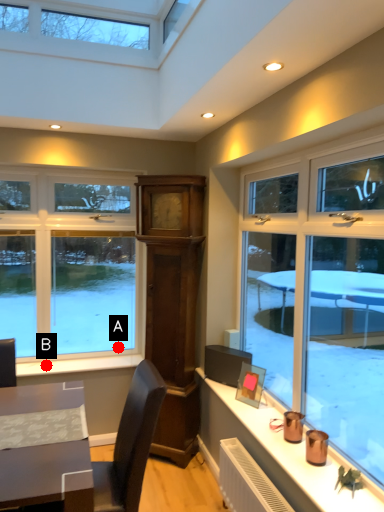
Question: Two points are circled on the image, labeled by A and B beside each circle. Which point is closer to the camera?

Choices:
 (A) A is closer
 (B) B is closer

Answer: (B)